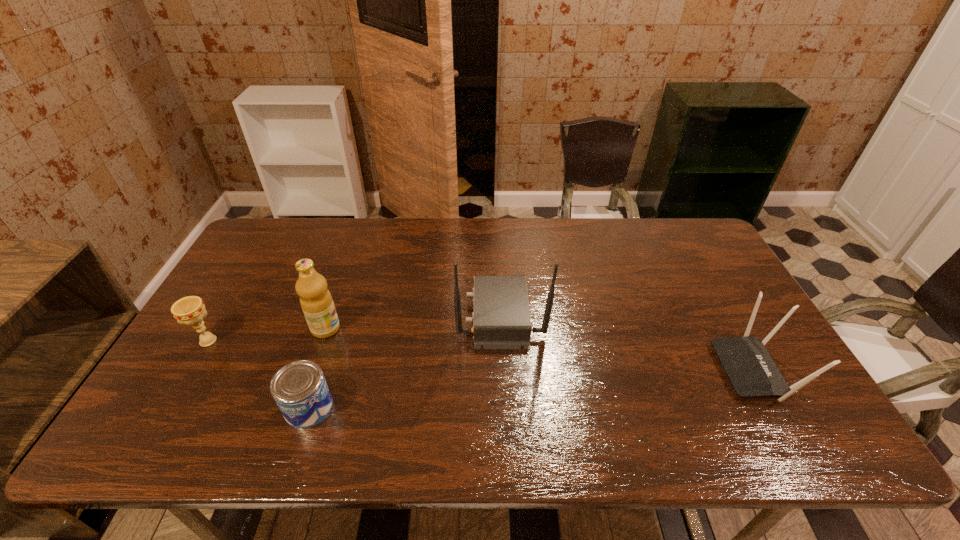
The width and height of the screenshot is (960, 540). I want to click on vacant space at the near edge of the desktop, so click(676, 429).

Locate an element on the screen. This screenshot has height=540, width=960. free region at the left edge of the desktop is located at coordinates (239, 357).

Identify the location of free space at the right edge of the desktop. (728, 333).

Locate an element on the screen. free space at the far left corner of the desktop is located at coordinates (295, 243).

Locate an element on the screen. blank space at the far right corner of the desktop is located at coordinates (706, 237).

Identify the location of free space between the can and the right router. (532, 389).

This screenshot has height=540, width=960. In order to click on empty space between the fourth object from left to right and the shortest object in this screenshot , I will do click(404, 361).

Where is `vacant space in between the olive oil and the shorter router`? The height and width of the screenshot is (540, 960). vacant space in between the olive oil and the shorter router is located at coordinates (540, 349).

Identify the location of free point between the chalice and the right router. (482, 355).

In order to click on free space between the second tallest object and the chalice in this screenshot , I will do `click(267, 335)`.